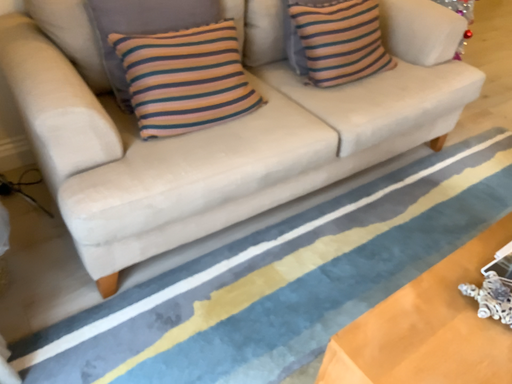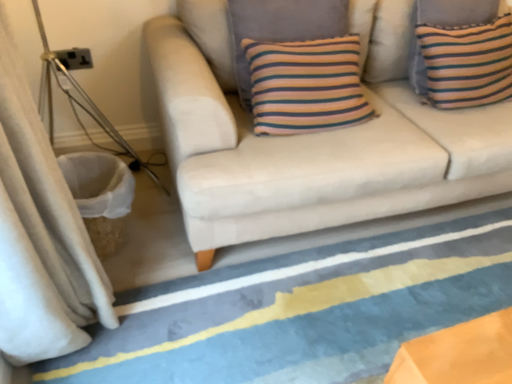
Question: How did the camera likely rotate when shooting the video?

Choices:
 (A) rotated left
 (B) rotated right

Answer: (A)